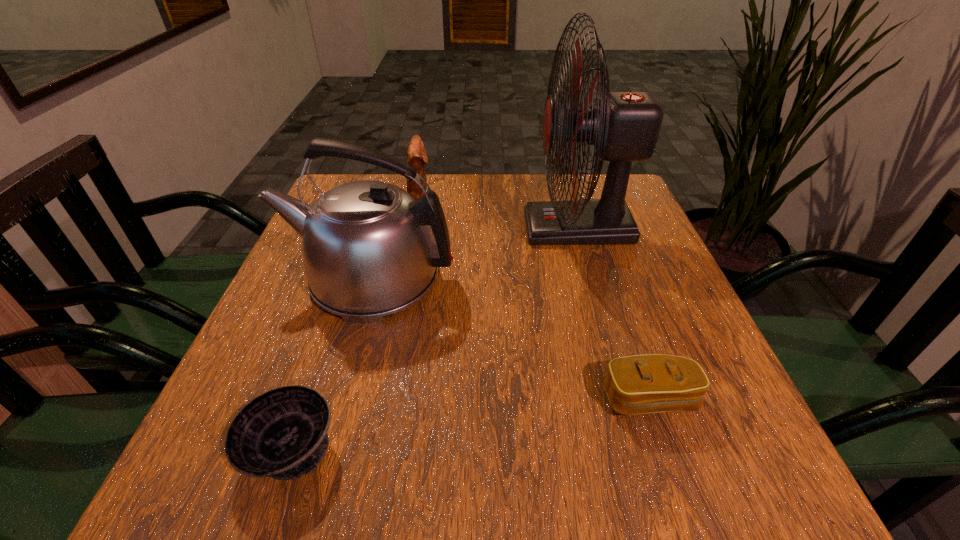
In order to click on fan in this screenshot , I will do `click(624, 126)`.

The image size is (960, 540). In order to click on kettle in this screenshot , I will do `click(370, 249)`.

Locate an element on the screen. The height and width of the screenshot is (540, 960). the farther clutch bag is located at coordinates (416, 157).

Identify the location of the taller clutch bag. (416, 157).

Where is `the shorter clutch bag`? The image size is (960, 540). the shorter clutch bag is located at coordinates (640, 384).

This screenshot has height=540, width=960. I want to click on the nearer clutch bag, so click(640, 384).

Locate an element on the screen. bowl is located at coordinates (282, 433).

Locate an element on the screen. Image resolution: width=960 pixels, height=540 pixels. vacant space located on the front-facing side of the tallest object is located at coordinates (480, 228).

The image size is (960, 540). I want to click on vacant space located 0.110m on the front-facing side of the tallest object, so click(x=480, y=228).

Find the location of a particular element. This screenshot has width=960, height=540. vacant region located on the front-facing side of the tallest object is located at coordinates (501, 228).